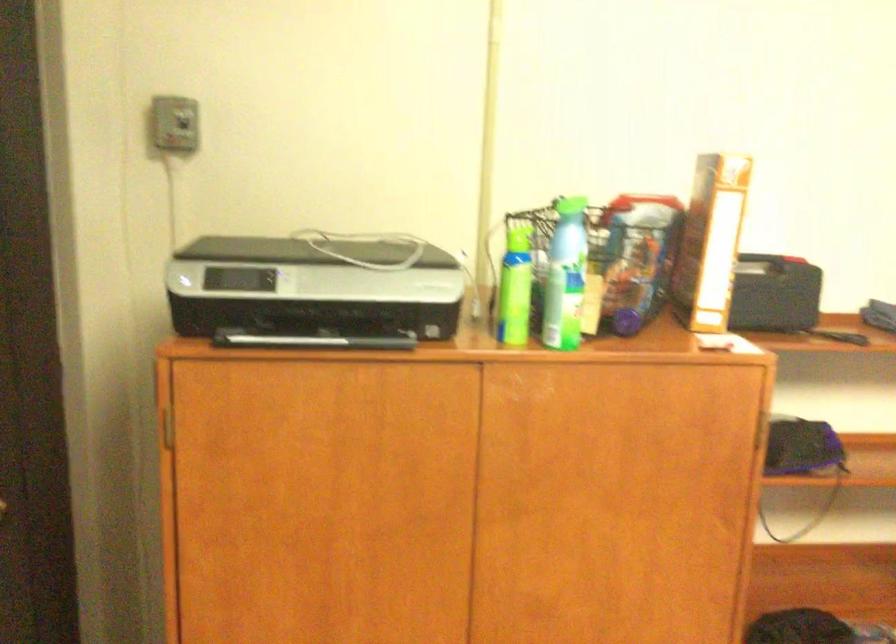
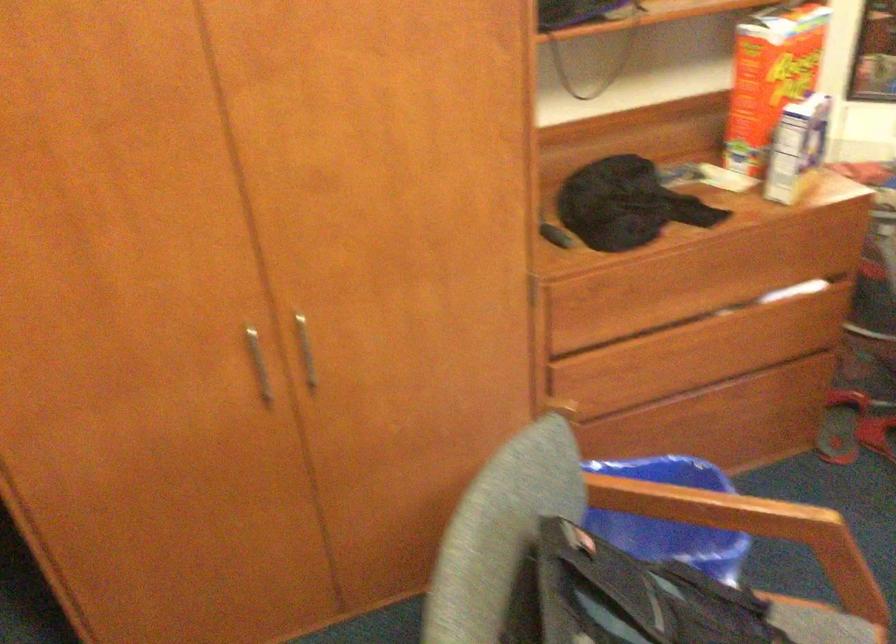
What movement of the cameraman would produce the second image?

The cameraman moved toward right, forward.